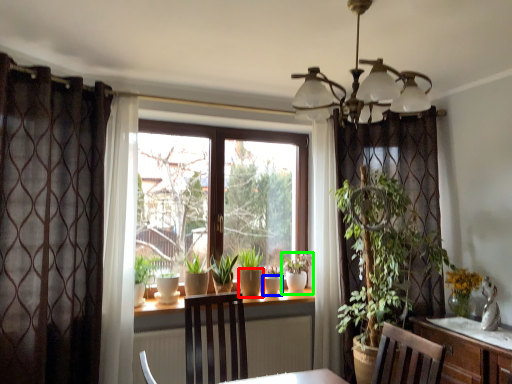
Question: Based on their relative distances, which object is farther from flowerpot (highlighted by a red box)? Choose from flowerpot (highlighted by a blue box) and houseplant (highlighted by a green box).

Choices:
 (A) flowerpot
 (B) houseplant

Answer: (B)